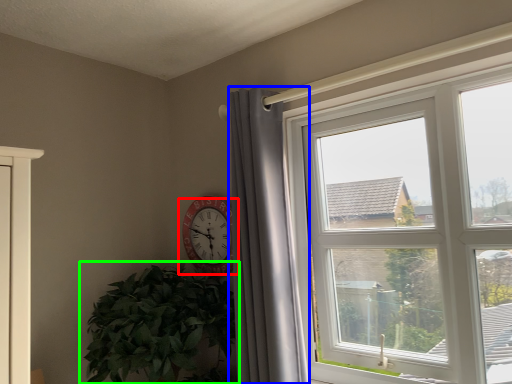
Question: Estimate the real-world distances between objects in this image. Which object is farther from wall clock (highlighted by a red box), curtain (highlighted by a blue box) or houseplant (highlighted by a green box)?

Choices:
 (A) curtain
 (B) houseplant

Answer: (A)